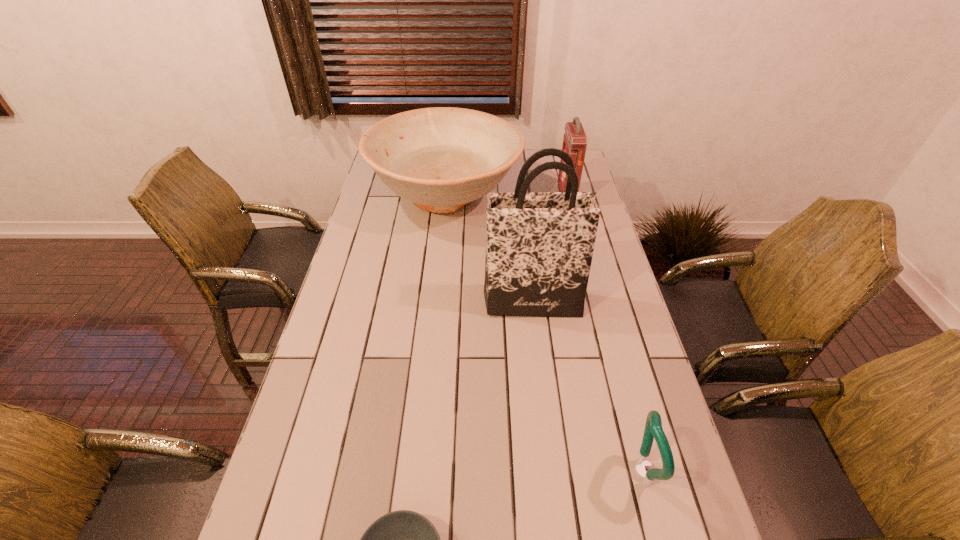
This screenshot has width=960, height=540. I want to click on the third nearest object, so click(x=539, y=245).

Identify the location of the tallest object. This screenshot has width=960, height=540. (539, 245).

Identify the location of the second tallest object. Image resolution: width=960 pixels, height=540 pixels. (574, 141).

Find the location of a particular element. The height and width of the screenshot is (540, 960). dish is located at coordinates (441, 158).

Identify the location of the fourth tallest object. The width and height of the screenshot is (960, 540). (653, 428).

Locate an element on the screen. the fourth farthest object is located at coordinates (653, 428).

This screenshot has height=540, width=960. Find the location of `vacant region located 0.320m on the front of the third farthest object with the design`. vacant region located 0.320m on the front of the third farthest object with the design is located at coordinates click(x=545, y=418).

Find the location of a particular element. The height and width of the screenshot is (540, 960). free location located on the front-facing side of the first-aid kit is located at coordinates (474, 195).

This screenshot has width=960, height=540. I want to click on free space located 0.120m on the front-facing side of the first-aid kit, so click(x=529, y=195).

This screenshot has height=540, width=960. What are the coordinates of `vacant region located on the front-facing side of the first-aid kit` in the screenshot? It's located at (535, 195).